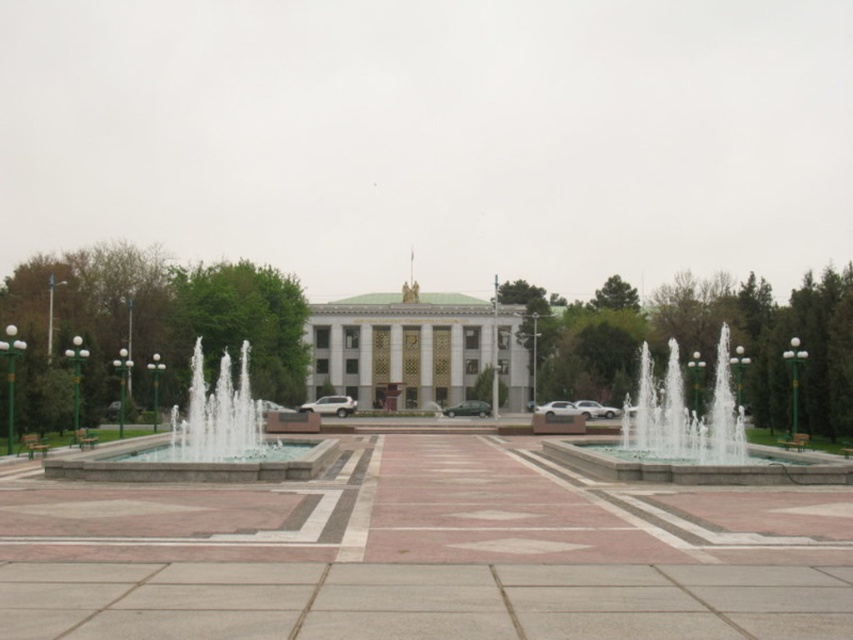
Question: Which is farther from the green marble palace at center?

Choices:
 (A) clear stone fountain at center
 (B) clear glass water at center

Answer: (A)

Question: From the image, what is the correct spatial relationship of clear stone fountain at center in relation to clear glass water at center?

Choices:
 (A) above
 (B) below

Answer: (B)

Question: Does green marble palace at center lie behind clear glass water at center?

Choices:
 (A) no
 (B) yes

Answer: (B)

Question: Which object is farther from the camera taking this photo?

Choices:
 (A) clear stone fountain at center
 (B) green marble palace at center

Answer: (B)

Question: Considering the relative positions of green marble palace at center and clear glass water at center in the image provided, where is green marble palace at center located with respect to clear glass water at center?

Choices:
 (A) below
 (B) above

Answer: (A)

Question: Among these objects, which one is nearest to the camera?

Choices:
 (A) clear glass water at center
 (B) green marble palace at center

Answer: (A)